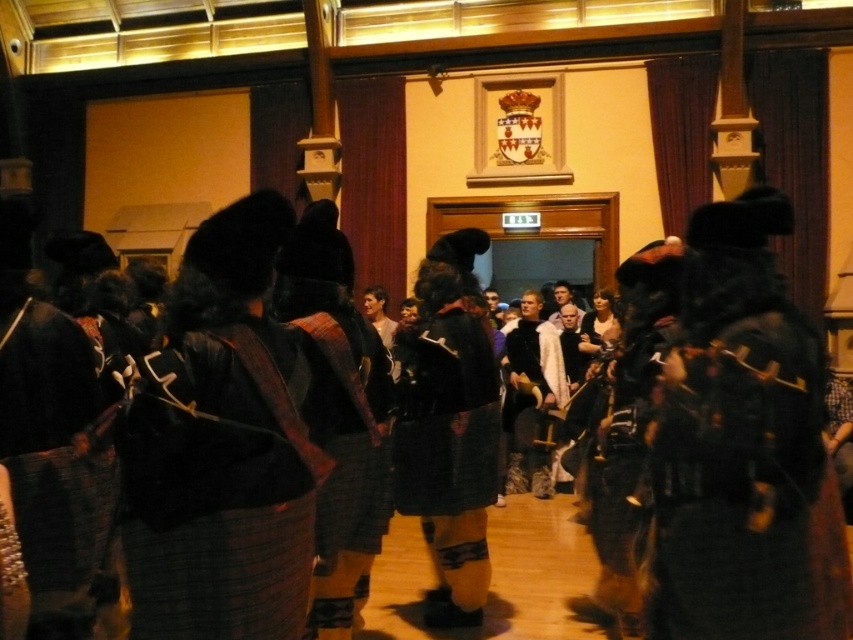
You are standing in the grand hall and want to find the velvet black kilt at right. According to the coordinates provided, where should you look to locate it?

The velvet black kilt at right is located at coordinates point (743, 445).

From the picture: You are organizing a Scottish cultural event and need to display two kilts in the hall. The velvet black kilt at right and the plaid wool kilt at center must be arranged so that the larger one is placed on a special stand. Which kilt should you place on the stand?

The velvet black kilt at right is bigger than the plaid wool kilt at center, so you should place the velvet black kilt at right on the special stand.

You are a photographer at the event and need to capture both the plaid wool kilt at center and the black woolen kilt at center in the same frame. Which kilt should you position closer to the camera to ensure both fit in the frame?

The plaid wool kilt at center might be wider than black woolen kilt at center, so positioning the plaid wool kilt at center closer to the camera would help ensure both fit within the frame by utilizing depth of field and perspective.